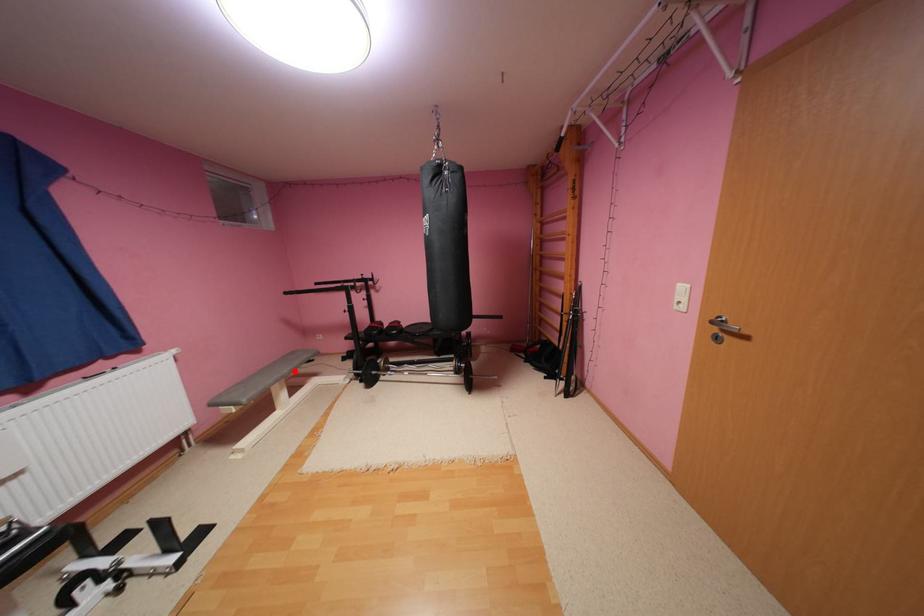
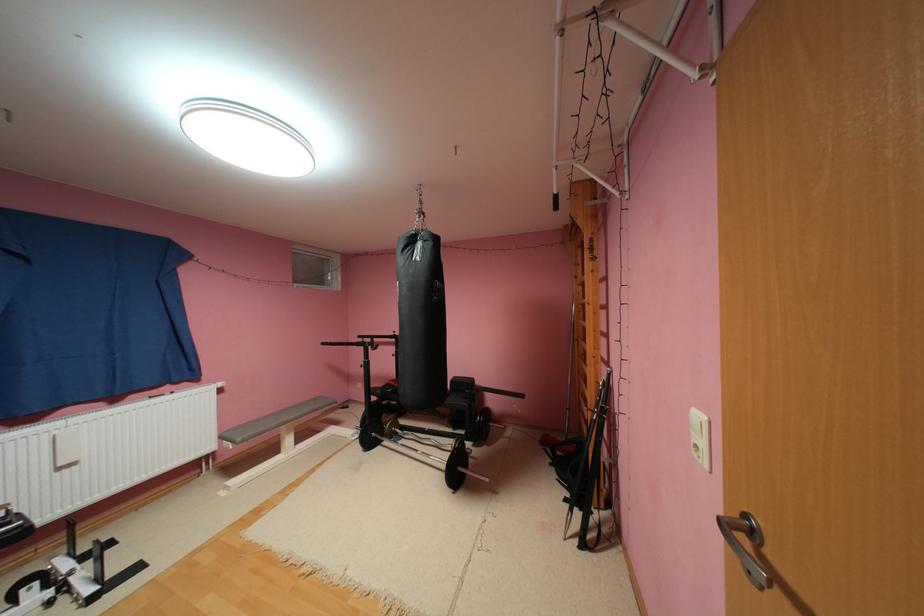
Question: I am providing you with two images of the same scene from different viewpoints. Given a red point in image1, look at the same physical point in image2. Is it:

Choices:
 (A) Closer to the viewpoint
 (B) Farther from the viewpoint

Answer: (B)